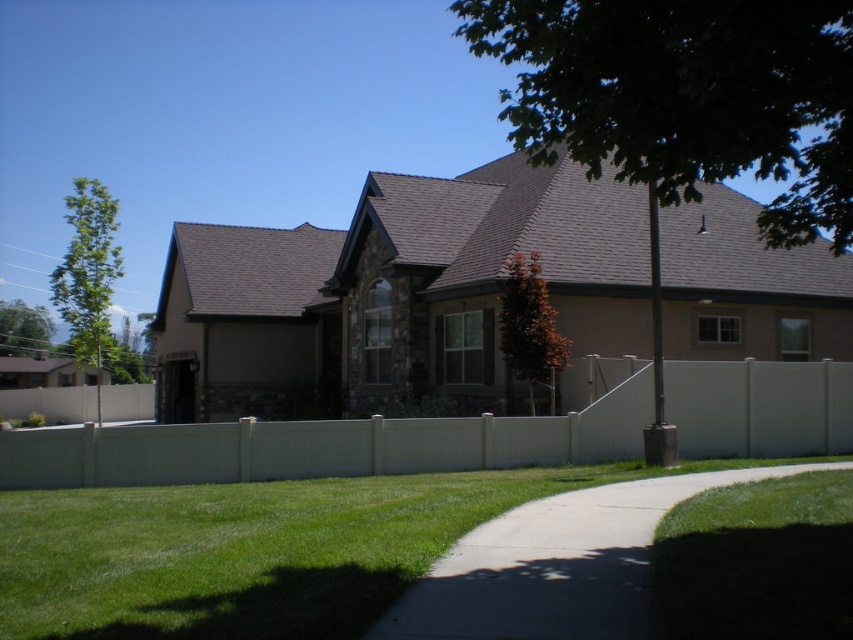
Can you confirm if green grass at lower left is positioned to the left of white vinyl fence at center?

Indeed, green grass at lower left is positioned on the left side of white vinyl fence at center.

Consider the image. Is green grass at lower left positioned behind white vinyl fence at center?

No, it is not.

Is point (466, 476) positioned before point (134, 445)?

No, it is behind (134, 445).

Where is `green grass at lower left`? The width and height of the screenshot is (853, 640). green grass at lower left is located at coordinates (242, 552).